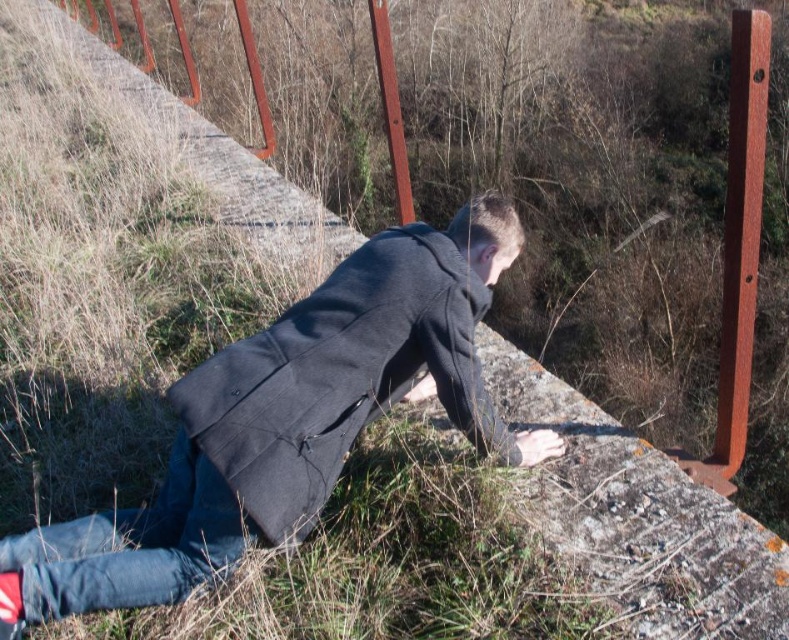
Who is taller, dark gray matte sweatshirt at center or rusty metal pole at upper center?

Standing taller between the two is dark gray matte sweatshirt at center.

Between dark gray matte sweatshirt at center and rusty metal pole at upper center, which one appears on the right side from the viewer's perspective?

rusty metal pole at upper center

Describe the element at coordinates (341, 376) in the screenshot. This screenshot has height=640, width=789. I see `dark gray matte sweatshirt at center` at that location.

Find the location of a particular element. The height and width of the screenshot is (640, 789). dark gray matte sweatshirt at center is located at coordinates (341, 376).

Is rusty metal pole at right thinner than rusty metal pole at upper center?

In fact, rusty metal pole at right might be wider than rusty metal pole at upper center.

This screenshot has height=640, width=789. What do you see at coordinates (739, 240) in the screenshot? I see `rusty metal pole at right` at bounding box center [739, 240].

You are a GUI agent. You are given a task and a screenshot of the screen. Output one action in this format:
    pyautogui.click(x=<x>, y=<y>)
    Task: Click on the rusty metal pole at right
    Image resolution: width=789 pixels, height=640 pixels.
    Given the screenshot: What is the action you would take?
    pyautogui.click(x=739, y=240)

Is dark gray matte sweatshirt at center to the left of rusty metal pole at right from the viewer's perspective?

Yes, dark gray matte sweatshirt at center is to the left of rusty metal pole at right.

Can you confirm if dark gray matte sweatshirt at center is thinner than rusty metal pole at right?

Yes, dark gray matte sweatshirt at center is thinner than rusty metal pole at right.

Is point (252, 452) behind point (682, 465)?

No.

Locate an element on the screen. dark gray matte sweatshirt at center is located at coordinates (341, 376).